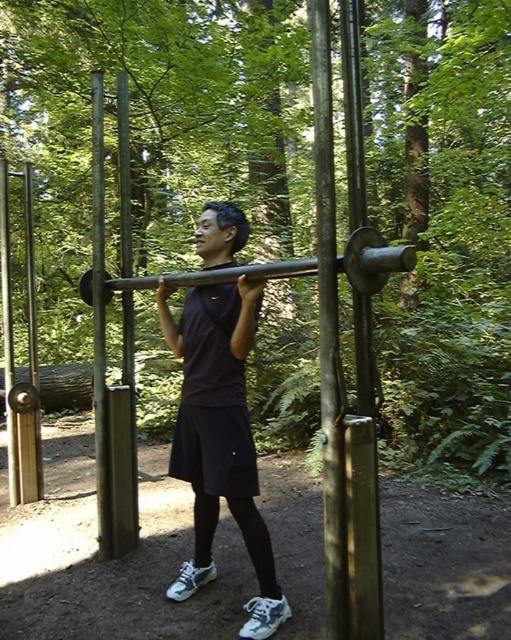
Question: Is the position of black metallic barbell at center less distant than that of metallic silver pole at center?

Choices:
 (A) no
 (B) yes

Answer: (B)

Question: Which point is closer to the camera taking this photo?

Choices:
 (A) (266, 545)
 (B) (321, 296)
 (C) (243, 269)
 (D) (125, 340)

Answer: (B)

Question: Among these points, which one is nearest to the camera?

Choices:
 (A) (324, 29)
 (B) (86, 298)

Answer: (A)

Question: Among these points, which one is farthest from the camera?

Choices:
 (A) (365, 269)
 (B) (319, 237)
 (C) (229, 330)

Answer: (C)

Question: Does dark purple shirt at center appear on the left side of smooth metal pole at center?

Choices:
 (A) yes
 (B) no

Answer: (A)

Question: Does dark purple shirt at center have a lesser width compared to smooth metal pole at center?

Choices:
 (A) yes
 (B) no

Answer: (B)